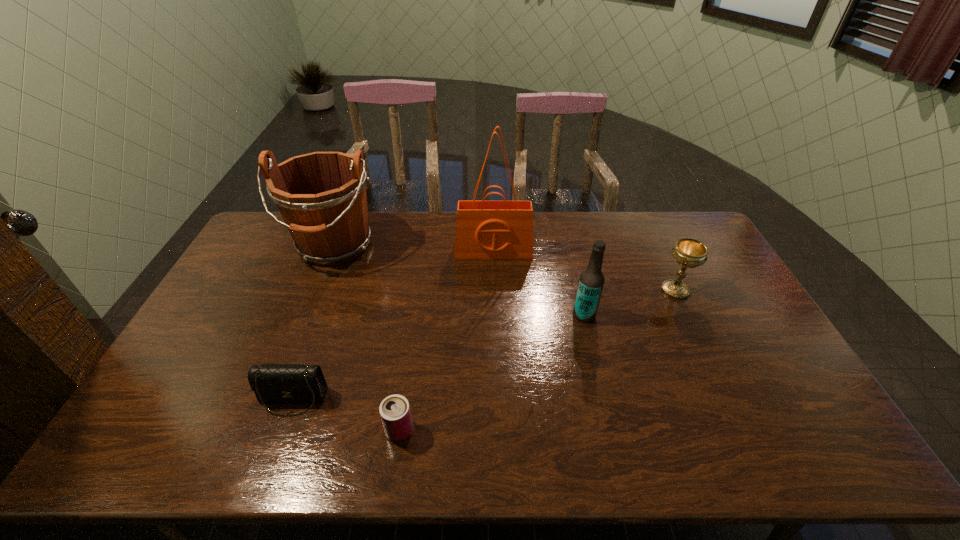
At what (x,y) coordinates should I click in order to perform the action: click on vacant area that lies between the fourth object from right to left and the fourth nearest object. Please return your answer as a coordinate pair (x, y). Image resolution: width=960 pixels, height=540 pixels. Looking at the image, I should click on (538, 360).

Where is `free point between the tote bag and the fourth object from right to left`? free point between the tote bag and the fourth object from right to left is located at coordinates (446, 341).

Where is `vacant point located between the beer bottle and the tallest object`? This screenshot has height=540, width=960. vacant point located between the beer bottle and the tallest object is located at coordinates (539, 283).

Identify the location of free spot between the can and the bucket. This screenshot has height=540, width=960. (367, 338).

Where is `vacant area that lies between the tallest object and the clutch bag`? This screenshot has height=540, width=960. vacant area that lies between the tallest object and the clutch bag is located at coordinates (393, 325).

Identify the location of unoccupied area between the fifth farthest object and the fourth nearest object. This screenshot has width=960, height=540. (x=484, y=345).

This screenshot has height=540, width=960. I want to click on empty location between the tote bag and the bucket, so click(x=414, y=248).

Identify the location of free space between the fourth object from left to right and the fourth object from right to left. (446, 341).

I want to click on the third closest object relative to the second tallest object, so click(395, 413).

Find the location of a particular element. The image size is (960, 540). the second closest object to the bucket is located at coordinates (275, 384).